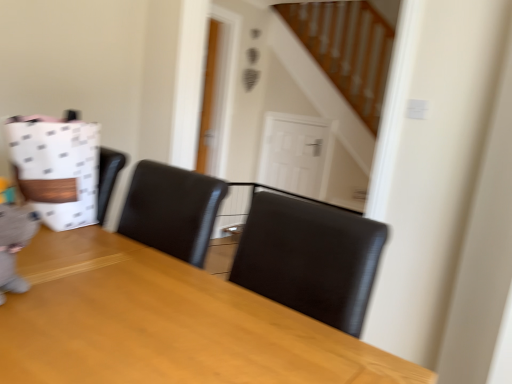
Question: Considering the relative positions of white dotted paper bag at left and wooden table at center in the image provided, is white dotted paper bag at left in front of wooden table at center?

Choices:
 (A) no
 (B) yes

Answer: (A)

Question: From the image's perspective, is white dotted paper bag at left beneath wooden table at center?

Choices:
 (A) no
 (B) yes

Answer: (A)

Question: Would you say white dotted paper bag at left is a long distance from wooden table at center?

Choices:
 (A) no
 (B) yes

Answer: (A)

Question: Does white dotted paper bag at left have a lesser width compared to wooden table at center?

Choices:
 (A) no
 (B) yes

Answer: (B)

Question: Considering the relative sizes of white dotted paper bag at left and wooden table at center in the image provided, is white dotted paper bag at left shorter than wooden table at center?

Choices:
 (A) yes
 (B) no

Answer: (A)

Question: Considering the relative positions of white dotted paper bag at left and wooden table at center in the image provided, is white dotted paper bag at left to the right of wooden table at center from the viewer's perspective?

Choices:
 (A) no
 (B) yes

Answer: (A)

Question: Can you confirm if white glossy door at center is taller than wooden table at center?

Choices:
 (A) no
 (B) yes

Answer: (A)

Question: Considering the relative sizes of white glossy door at center and wooden table at center in the image provided, is white glossy door at center thinner than wooden table at center?

Choices:
 (A) no
 (B) yes

Answer: (B)

Question: Can you confirm if white glossy door at center is positioned to the left of wooden table at center?

Choices:
 (A) no
 (B) yes

Answer: (A)

Question: Is white glossy door at center positioned beyond the bounds of wooden table at center?

Choices:
 (A) yes
 (B) no

Answer: (A)

Question: From the image's perspective, is white glossy door at center above wooden table at center?

Choices:
 (A) yes
 (B) no

Answer: (A)

Question: Is white glossy door at center not near wooden table at center?

Choices:
 (A) yes
 (B) no

Answer: (A)

Question: Is wooden table at center bigger than white dotted paper bag at left?

Choices:
 (A) no
 (B) yes

Answer: (B)